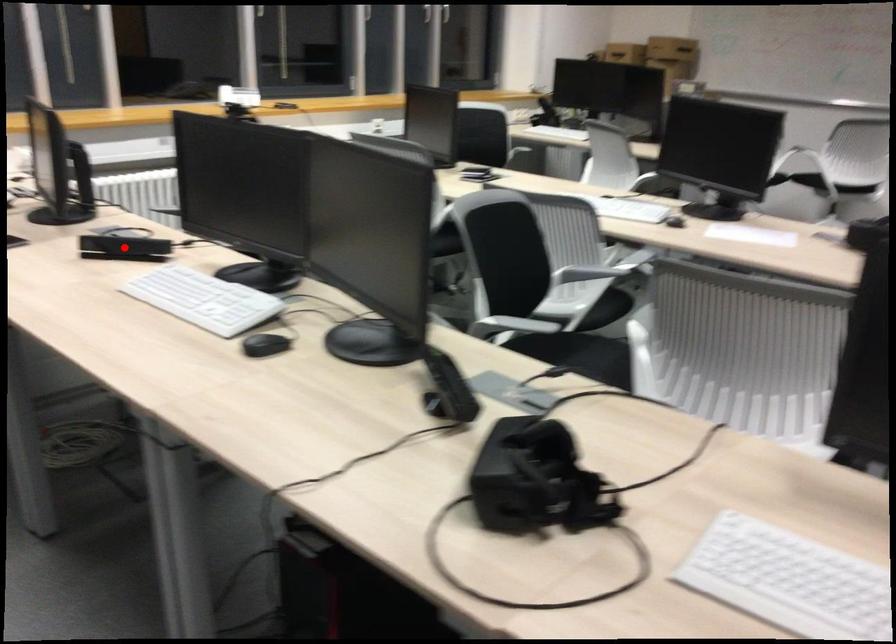
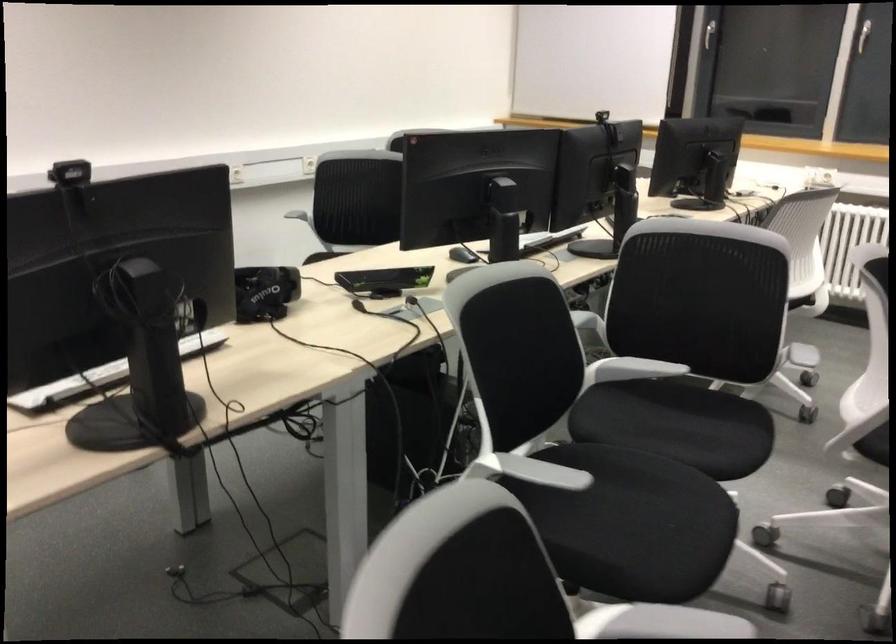
Question: I am providing you with two images of the same scene from different viewpoints. A red point is marked on the first image. Can you still see the location of the red point in image 2?

Choices:
 (A) Yes
 (B) No

Answer: (B)